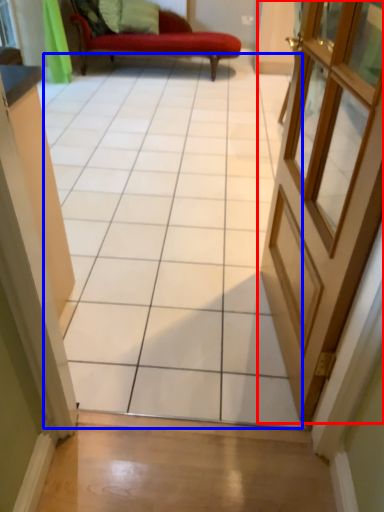
Question: Which object appears farthest to the camera in this image, door (highlighted by a red box) or ceramic tile (highlighted by a blue box)?

Choices:
 (A) door
 (B) ceramic tile

Answer: (A)